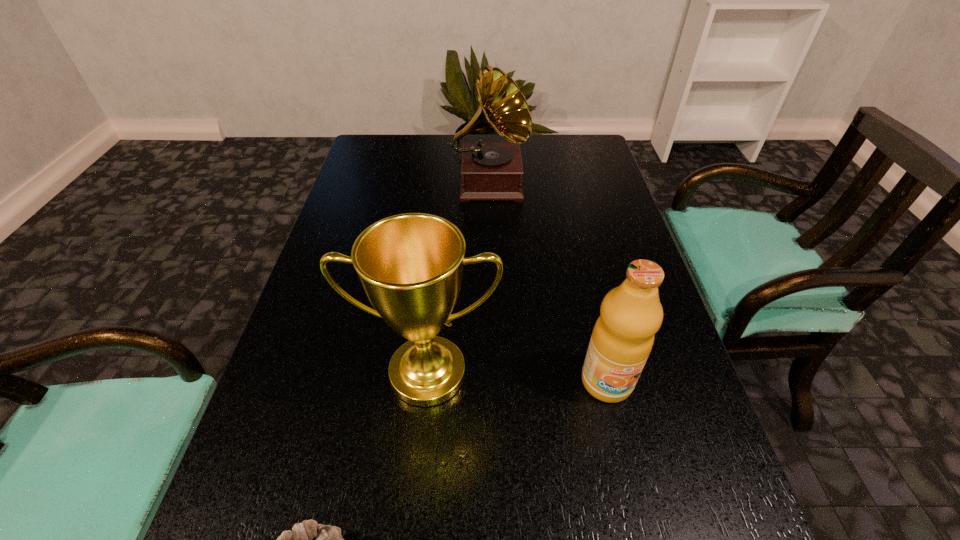
In the image, there is a desktop. What are the coordinates of `vacant region at the right edge` in the screenshot? It's located at 697,414.

The image size is (960, 540). Identify the location of free space at the far left corner of the desktop. (391, 151).

The image size is (960, 540). In order to click on free space between the farthest object and the fruit juice in this screenshot , I will do `click(548, 282)`.

In order to click on free space between the phonograph record and the rightmost object in this screenshot , I will do `click(548, 282)`.

You are a GUI agent. You are given a task and a screenshot of the screen. Output one action in this format:
    pyautogui.click(x=<x>, y=<y>)
    Task: Click on the vacant space that is in between the award and the rightmost object
    
    Given the screenshot: What is the action you would take?
    pyautogui.click(x=517, y=377)

Locate an element on the screen. This screenshot has height=540, width=960. free space that is in between the fruit juice and the award is located at coordinates (517, 377).

This screenshot has height=540, width=960. Identify the location of object that stands as the third closest to the award. (490, 170).

Where is `object that is the second closest to the fruit juice`? object that is the second closest to the fruit juice is located at coordinates (308, 539).